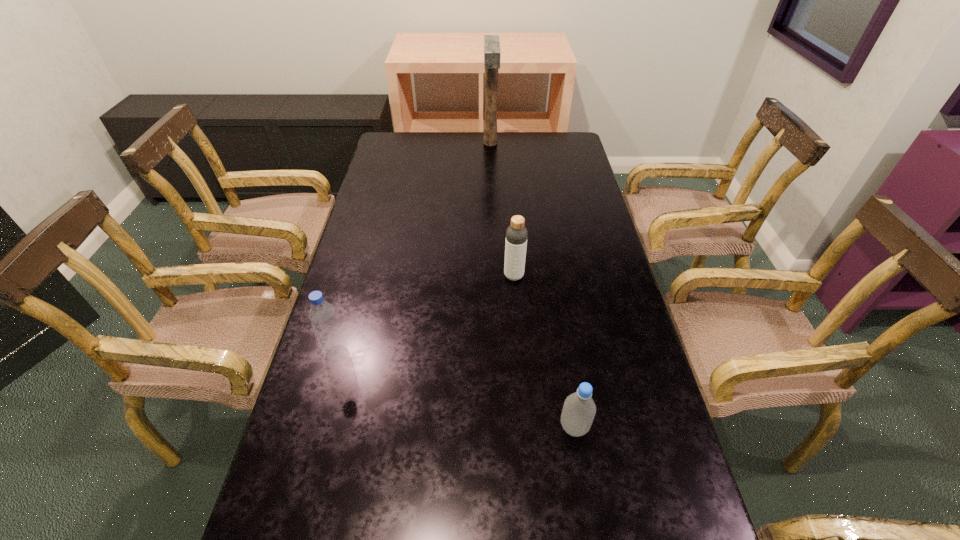
Identify the location of the second closest bottle to the second bottle from left to right. (322, 315).

Point out which bottle is positioned as the nearest to the farthest object. Please provide its 2D coordinates. Your answer should be formatted as a tuple, i.e. [(x, y)], where the tuple contains the x and y coordinates of a point satisfying the conditions above.

[(516, 234)]

Locate an element on the screen. This screenshot has width=960, height=540. vacant space that satisfies the following two spatial constraints: 1. on the back side of the leftmost object; 2. on the left side of the tallest object is located at coordinates (395, 143).

Identify the location of free spot that satisfies the following two spatial constraints: 1. on the front side of the mallet; 2. on the right side of the second bottle from left to right. This screenshot has width=960, height=540. (494, 276).